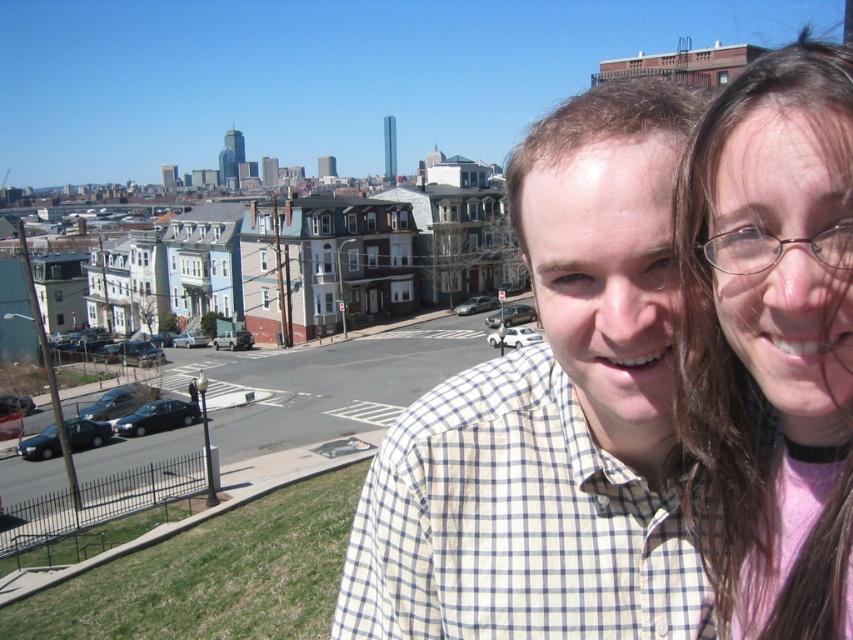
Who is more distant from viewer, [416,448] or [723,248]?

Positioned behind is point [416,448].

Is white checkered shirt at center wider than pink fabric at upper right?

Yes, white checkered shirt at center is wider than pink fabric at upper right.

Does point (666, 460) come in front of point (814, 180)?

No.

Identify the location of white checkered shirt at center. The width and height of the screenshot is (853, 640). (589, 438).